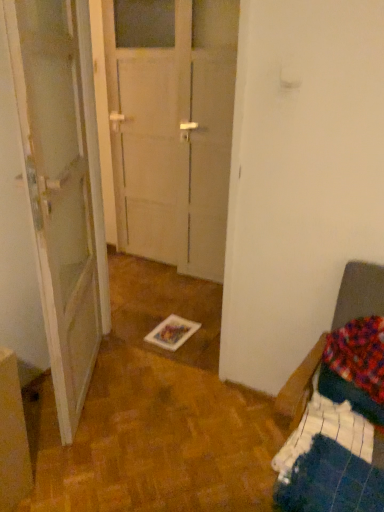
Question: Looking at their shapes, would you say transparent glass door at center is wider or thinner than dark blue fabric bed at right?

Choices:
 (A) thin
 (B) wide

Answer: (A)

Question: From the image's perspective, is transparent glass door at center located above or below dark blue fabric bed at right?

Choices:
 (A) below
 (B) above

Answer: (B)

Question: Based on their relative distances, which object is nearer to the transparent glass door at center?

Choices:
 (A) dark blue fabric bed at right
 (B) white glossy door at left

Answer: (B)

Question: Which object is the closest to the transparent glass door at center?

Choices:
 (A) dark blue fabric bed at right
 (B) white glossy door at left

Answer: (B)